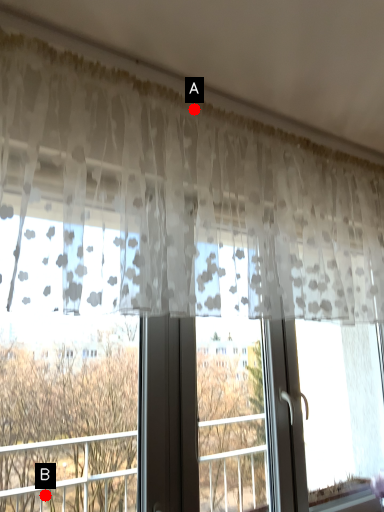
Question: Two points are circled on the image, labeled by A and B beside each circle. Which of the following is the farthest from the observer?

Choices:
 (A) A is further
 (B) B is further

Answer: (A)